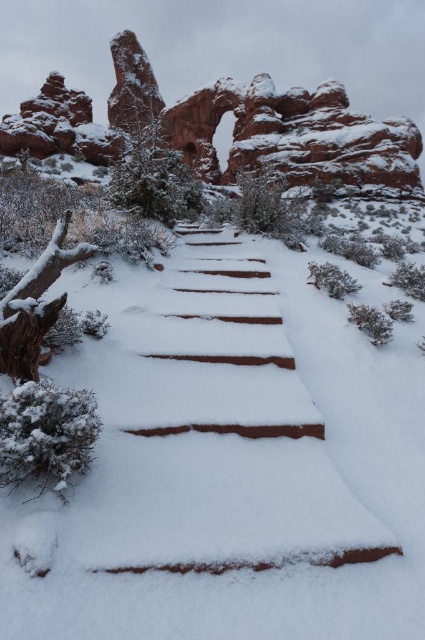
Who is positioned more to the right, snow-covered stone stairs at center or reddish-brown textured rock formation at upper center?

snow-covered stone stairs at center

Can you confirm if snow-covered stone stairs at center is taller than reddish-brown textured rock formation at upper center?

Incorrect, snow-covered stone stairs at center's height is not larger of reddish-brown textured rock formation at upper center's.

Is point (260, 273) farther from camera compared to point (5, 136)?

That is False.

Find the location of `snow-covered stone stairs at center`. snow-covered stone stairs at center is located at coordinates (207, 429).